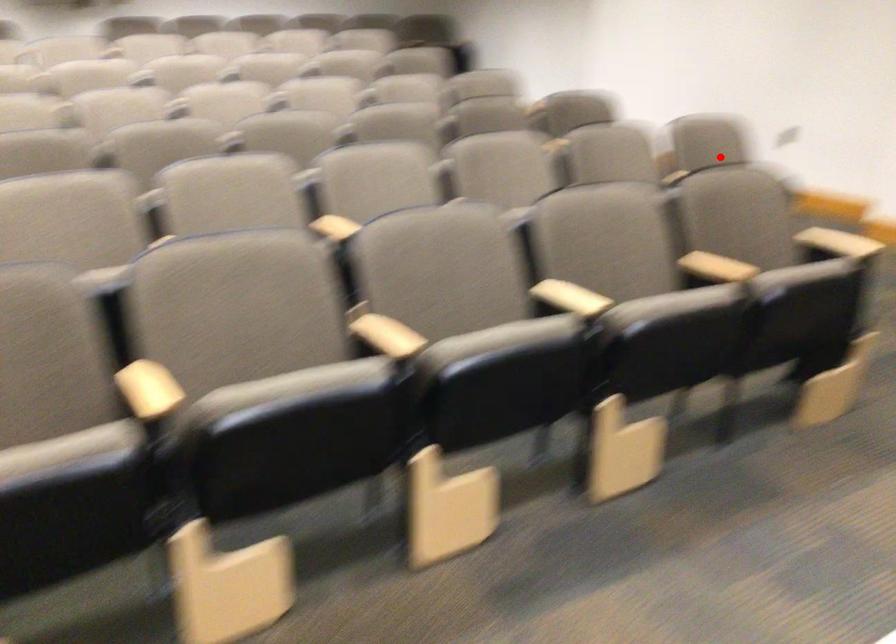
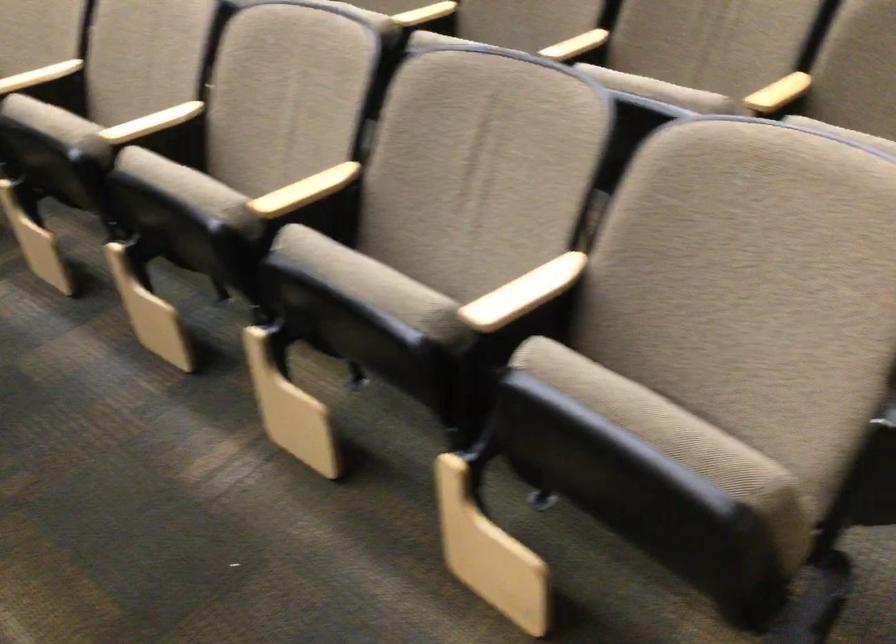
The point at the highlighted location is marked in the first image. Where is the corresponding point in the second image?

(522, 292)